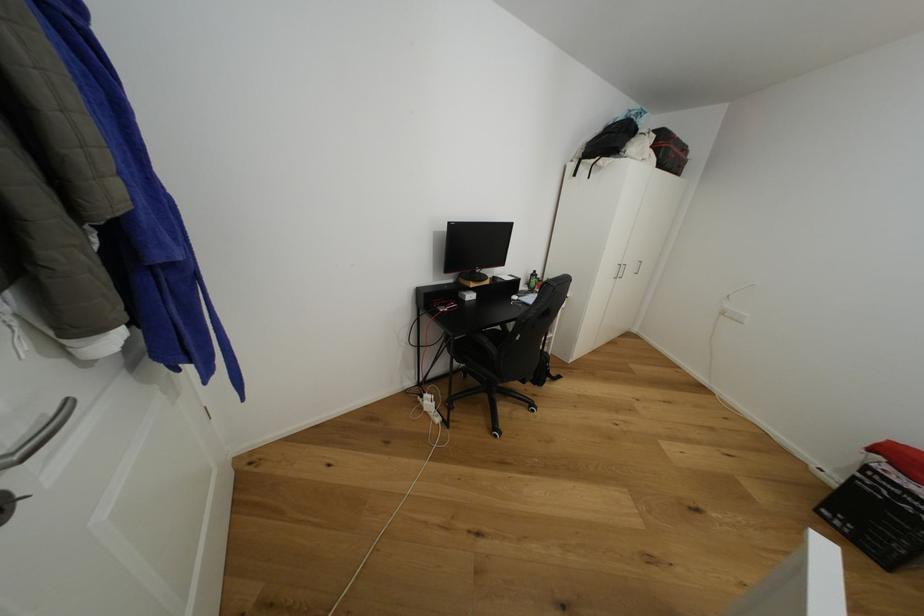
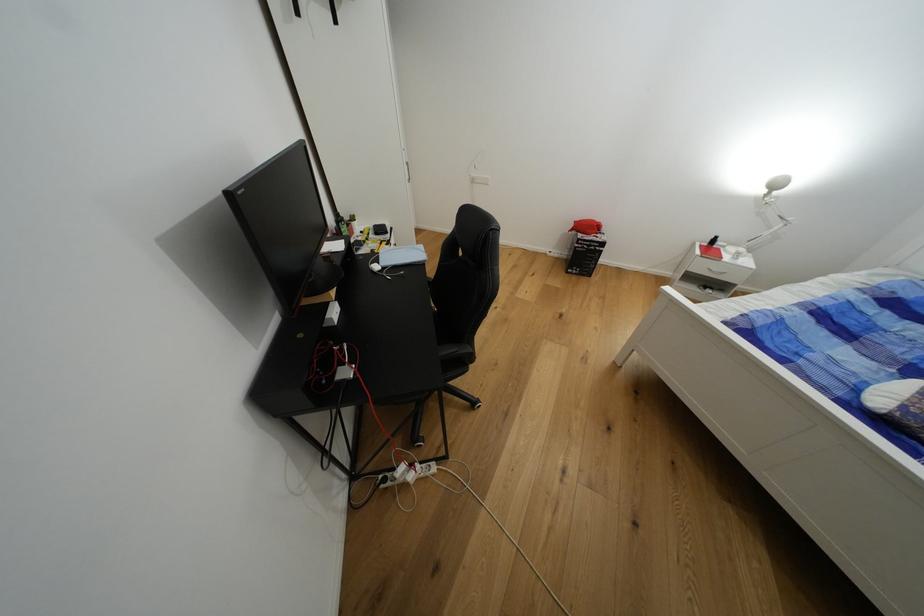
Locate, in the second image, the point that corresponds to point (822, 513) in the first image.

(573, 274)